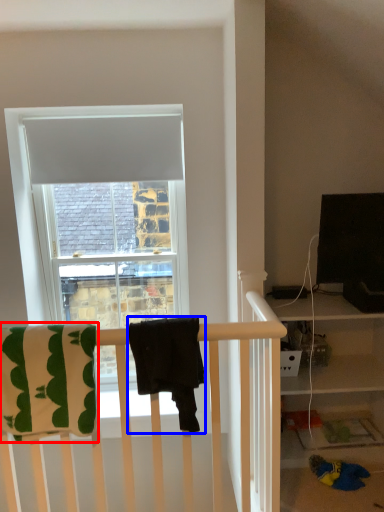
Question: Which object is closer to the camera taking this photo, beach towel (highlighted by a red box) or beach towel (highlighted by a blue box)?

Choices:
 (A) beach towel
 (B) beach towel

Answer: (B)